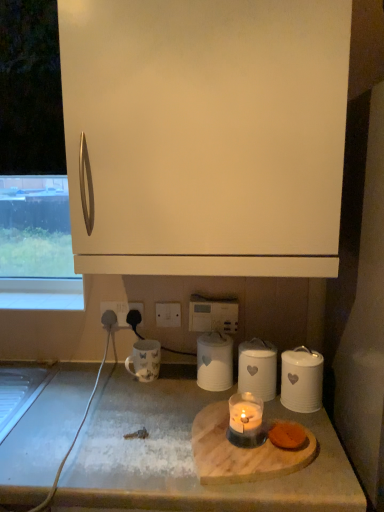
At what (x,y) coordinates should I click in order to perform the action: click on vacant space behind wooden cutting board at center. Please return your answer as a coordinate pair (x, y). This screenshot has height=512, width=384. Looking at the image, I should click on (192, 395).